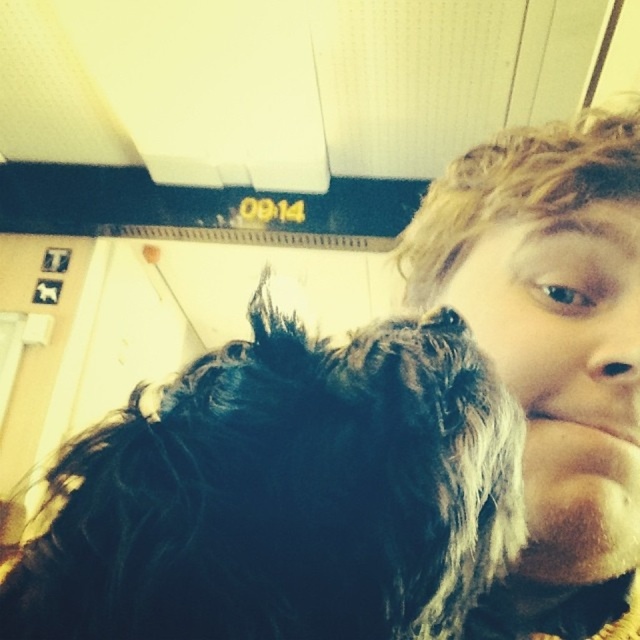
You are taking a selfie and want to ensure both the curly blonde hair at right and the brown matte nose at center are clearly visible. Based on their positions, which one is taller in the photo?

The curly blonde hair at right is taller than the brown matte nose at center in the photo.

You are holding a phone to take a selfie. The phone has a screen size of 6.2 inches. The point at coordinates point [520,131] is where you want to place the dog in the frame. Can the dog fit entirely within the screen?

The distance between the point at coordinates point [520,131] and the edge of the screen is 22.28 inches. Since the phone screen is only 6.2 inches, the dog cannot fit entirely within the screen because the required space exceeds the screen size.

You are holding a small toy that is 3 inches wide. If you want to place it exactly where the point at (436, 467) is located in the image, will the toy fit without overlapping any objects?

The point at (436, 467) is 9.25 inches from the viewer. Since the toy is only 3 inches wide, it will fit without overlapping any objects as there is sufficient space around the point.